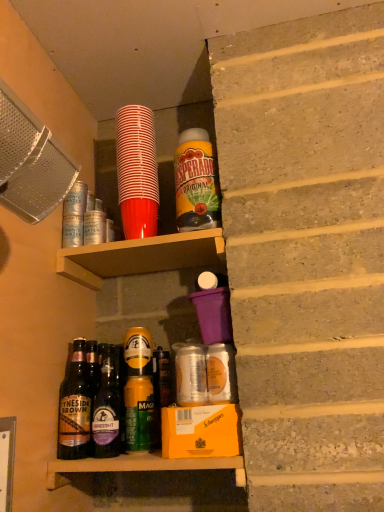
Question: Is purple plastic cup at upper center spatially inside red plastic cup at upper center, which is the 3th bottle in right-to-left order, or outside of it?

Choices:
 (A) inside
 (B) outside

Answer: (B)

Question: From a real-world perspective, is purple plastic cup at upper center positioned above or below red plastic cup at upper center, positioned as the 3th bottle in left-to-right order?

Choices:
 (A) above
 (B) below

Answer: (B)

Question: Which object is positioned farthest from the red plastic cup at upper center, positioned as the 3th bottle in left-to-right order?

Choices:
 (A) purple plastic cup at upper center
 (B) brown glass bottle at lower left, the fifth bottle from the right
 (C) dark brown glass bottle at center, positioned as the 2th bottle in left-to-right order
 (D) yellow matte bottle at upper center, arranged as the 5th bottle when viewed from the left
 (E) metallic gold can at center, the 2th bottle when ordered from right to left

Answer: (B)

Question: Which of these objects is positioned closest to the metallic gold can at center, the 2th bottle when ordered from right to left?

Choices:
 (A) purple plastic cup at upper center
 (B) yellow matte bottle at upper center, arranged as the 5th bottle when viewed from the left
 (C) red plastic cup at upper center, which is the 3th bottle in right-to-left order
 (D) dark brown glass bottle at center, the fourth bottle from the right
 (E) brown glass bottle at lower left, the fifth bottle from the right

Answer: (D)